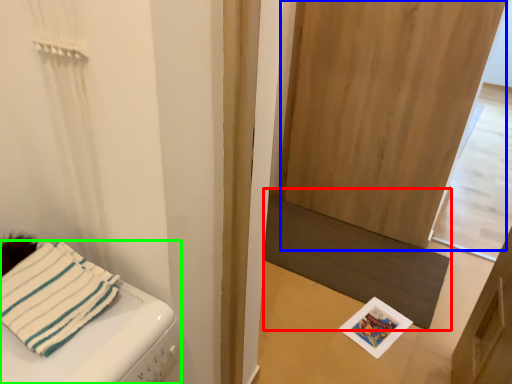
Question: Based on their relative distances, which object is farther from mat (highlighted by a red box)? Choose from screen door (highlighted by a blue box) and furniture (highlighted by a green box).

Choices:
 (A) screen door
 (B) furniture

Answer: (B)